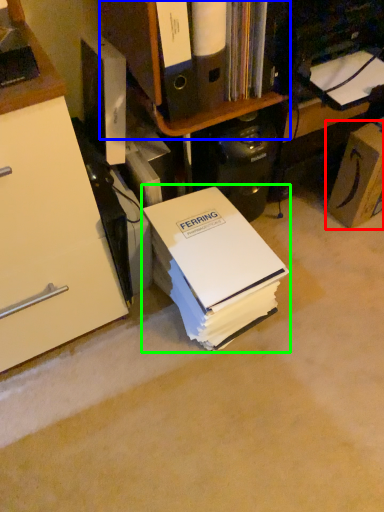
Question: Estimate the real-world distances between objects in this image. Which object is farther from cardboard box (highlighted by a red box), shelf (highlighted by a blue box) or paperback book (highlighted by a green box)?

Choices:
 (A) shelf
 (B) paperback book

Answer: (B)